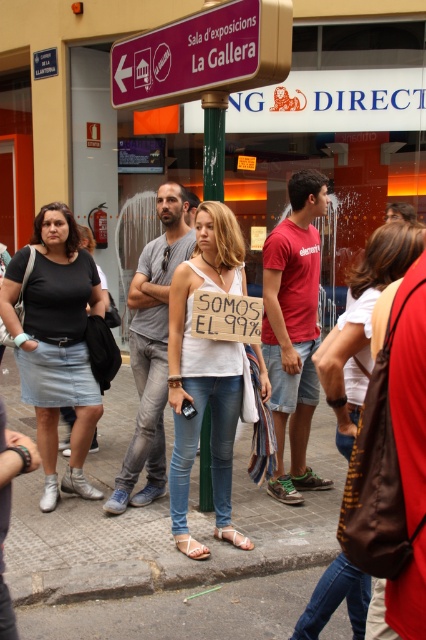
You are a pedestrian trying to read the protest sign held by someone wearing denim jeans at center. Can you see the purple plastic sign at upper center from your current position?

The purple plastic sign at upper center is above the denim jeans at center, so yes, you can see the purple plastic sign at upper center from your current position as it is positioned higher up.

You are a pedestrian trying to cross the street where the protest is happening. You notice a person wearing a white cotton tank top at center and denim jeans at center. Which piece of clothing is visible higher up on their body?

The denim jeans at center are visible higher up on the body since the white cotton tank top at center is positioned under them.